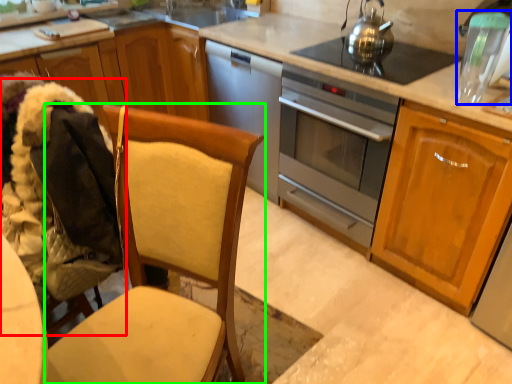
Question: Estimate the real-world distances between objects in this image. Which object is closer to folding chair (highlighted by a red box), appliance (highlighted by a blue box) or chair (highlighted by a green box)?

Choices:
 (A) appliance
 (B) chair

Answer: (B)